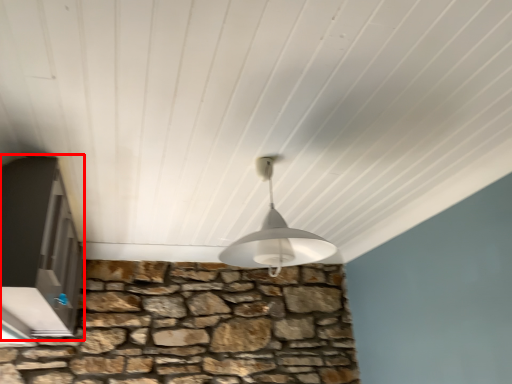
Question: Where is window (annotated by the red box) located in relation to lamp in the image?

Choices:
 (A) right
 (B) left

Answer: (B)